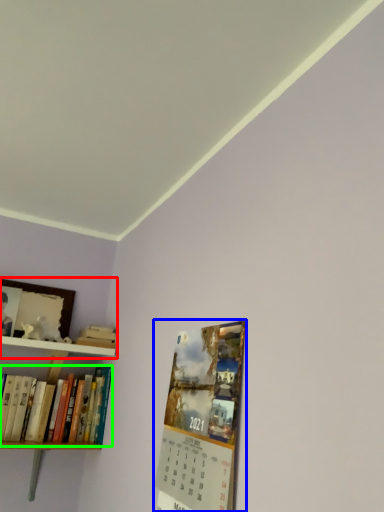
Question: Which object is positioned closest to shelf (highlighted by a red box)? Select from magazine (highlighted by a blue box) and book (highlighted by a green box).

Choices:
 (A) magazine
 (B) book

Answer: (B)